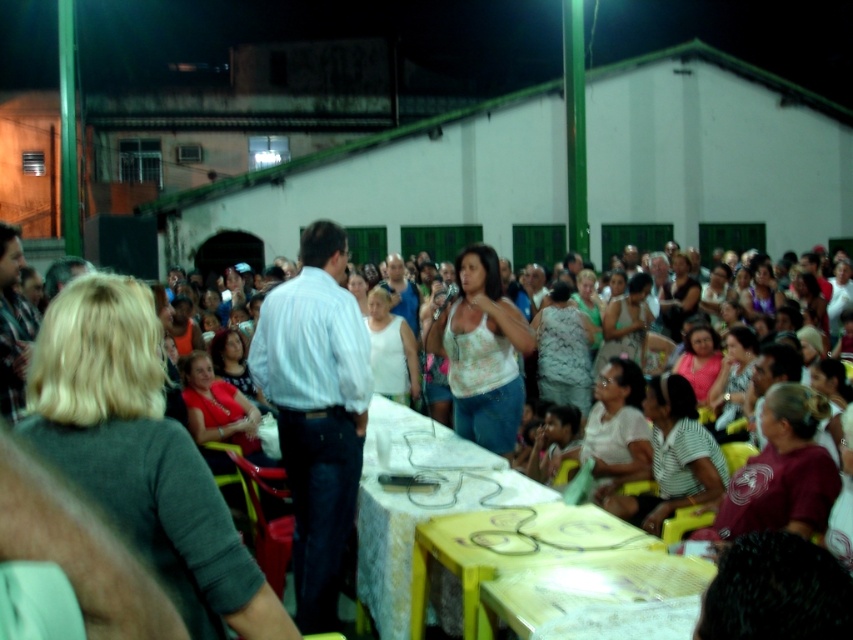
Question: Is white cotton shirt at center positioned at the back of wooden table at lower center?

Choices:
 (A) yes
 (B) no

Answer: (B)

Question: Which is nearer to the yellow plastic table at center?

Choices:
 (A) yellow glossy table at center
 (B) white cotton shirt at center
 (C) wooden table at lower center

Answer: (A)

Question: Can you confirm if white cotton shirt at center is bigger than white shirt at center?

Choices:
 (A) yes
 (B) no

Answer: (B)

Question: Estimate the real-world distances between objects in this image. Which object is farther from the yellow glossy table at center?

Choices:
 (A) wooden table at lower center
 (B) yellow plastic table at center

Answer: (B)

Question: In this image, where is white cotton shirt at center located relative to yellow glossy table at center?

Choices:
 (A) left
 (B) right

Answer: (A)

Question: Which point is closer to the camera taking this photo?

Choices:
 (A) (312, 440)
 (B) (190, 609)
 (C) (495, 564)
 (D) (364, 477)

Answer: (B)